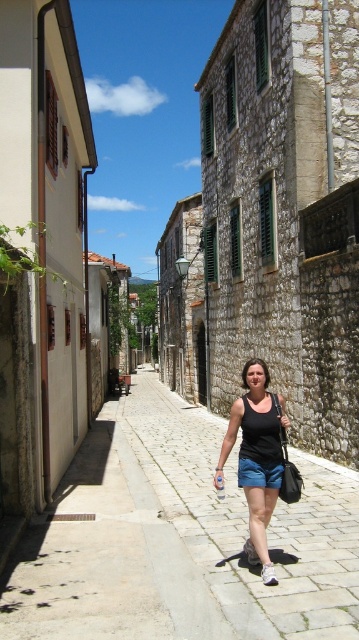
Between gray cobblestone pavement at center and black fabric tank top at center, which one is positioned higher?

black fabric tank top at center is higher up.

Between point (301, 545) and point (259, 502), which one is positioned in front?

Point (259, 502) is more forward.

This screenshot has height=640, width=359. In order to click on gray cobblestone pavement at center in this screenshot , I will do `click(246, 522)`.